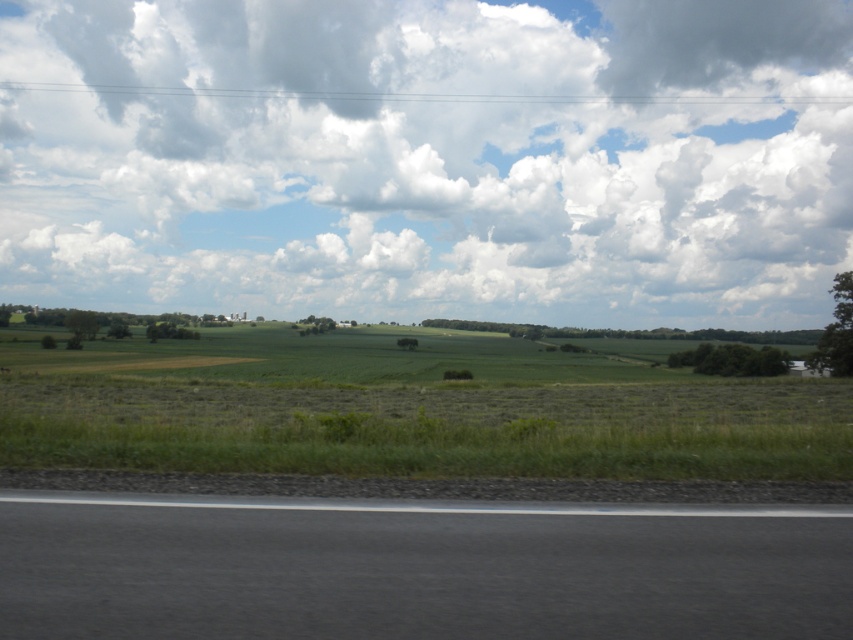
Question: In this image, where is green grassland at lower left located relative to green grassy field at center?

Choices:
 (A) below
 (B) above

Answer: (B)

Question: Which point is farther from the camera taking this photo?

Choices:
 (A) (744, 348)
 (B) (123, 330)
 (C) (403, 344)
 (D) (332, 532)

Answer: (B)

Question: Which object is farther from the camera taking this photo?

Choices:
 (A) green grassy field at center
 (B) cloudy sky at upper center
 (C) black asphalt road at lower center
 (D) green leafy tree at right

Answer: (A)

Question: Does green leafy tree at left come in front of green grassy field at center?

Choices:
 (A) no
 (B) yes

Answer: (A)

Question: Observing the image, what is the correct spatial positioning of green leafy tree at right in reference to green leafy tree at center?

Choices:
 (A) above
 (B) below

Answer: (B)

Question: Among these points, which one is farthest from the camera?

Choices:
 (A) (733, 364)
 (B) (407, 346)
 (C) (746, 45)
 (D) (312, 317)

Answer: (C)